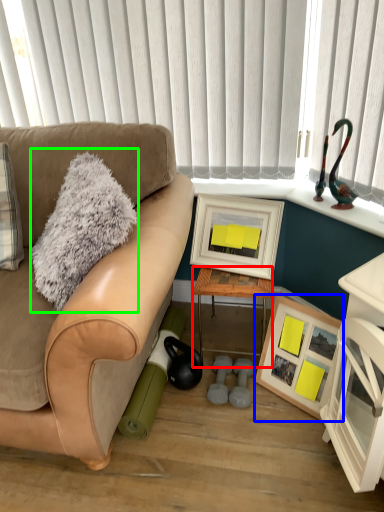
Question: Which object is the closest to the table (highlighted by a red box)? Choose among these: picture frame (highlighted by a blue box) or throw pillow (highlighted by a green box).

Choices:
 (A) picture frame
 (B) throw pillow

Answer: (A)